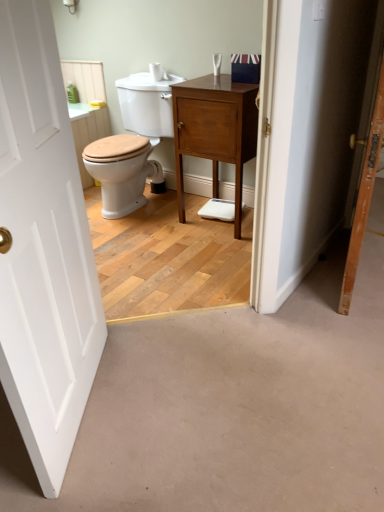
What do you see at coordinates (43, 248) in the screenshot? The width and height of the screenshot is (384, 512). I see `white wooden door at left, which is counted as the second door, starting from the right` at bounding box center [43, 248].

This screenshot has width=384, height=512. In order to click on matte wood nightstand at center in this screenshot , I will do `click(215, 130)`.

Is white wooden door at left, which is counted as the second door, starting from the right, closer to the viewer compared to wooden door at right, the second door in the left-to-right sequence?

Yes, the depth of white wooden door at left, which is counted as the second door, starting from the right, is less than that of wooden door at right, the second door in the left-to-right sequence.

Considering the positions of points (40, 211) and (379, 92), is point (40, 211) farther from camera compared to point (379, 92)?

No.

Is wooden door at right, the second door in the left-to-right sequence, completely or partially inside white wooden door at left, marked as the 1th door in a left-to-right arrangement?

No, wooden door at right, the second door in the left-to-right sequence, is not surrounded by white wooden door at left, marked as the 1th door in a left-to-right arrangement.

How different are the orientations of white wooden door at left, which is counted as the second door, starting from the right, and wooden door at right, acting as the 1th door starting from the right, in degrees?

white wooden door at left, which is counted as the second door, starting from the right, and wooden door at right, acting as the 1th door starting from the right, are facing 17.4 degrees away from each other.

Consider the image. From the image's perspective, between wooden door at right, the second door in the left-to-right sequence, and matte wood nightstand at center, who is located below?

wooden door at right, the second door in the left-to-right sequence, from the image's perspective.

Is wooden door at right, the second door in the left-to-right sequence, spatially inside matte wood nightstand at center, or outside of it?

wooden door at right, the second door in the left-to-right sequence, is not inside matte wood nightstand at center, it's outside.

In the scene shown: Is wooden door at right, acting as the 1th door starting from the right, facing towards matte wood nightstand at center?

No.

From a real-world perspective, which is physically below, white wooden door at left, which is counted as the second door, starting from the right, or matte wood nightstand at center?

matte wood nightstand at center.

How far apart are white wooden door at left, which is counted as the second door, starting from the right, and matte wood nightstand at center?

The distance of white wooden door at left, which is counted as the second door, starting from the right, from matte wood nightstand at center is 1.20 meters.

In the image, is white wooden door at left, which is counted as the second door, starting from the right, positioned in front of or behind matte wood nightstand at center?

Visually, white wooden door at left, which is counted as the second door, starting from the right, is located in front of matte wood nightstand at center.

Would you consider white wooden door at left, which is counted as the second door, starting from the right, to be distant from matte wood nightstand at center?

white wooden door at left, which is counted as the second door, starting from the right, is positioned a significant distance from matte wood nightstand at center.

Considering their positions, is matte wood nightstand at center located in front of or behind wooden door at right, the second door in the left-to-right sequence?

Clearly, matte wood nightstand at center is behind wooden door at right, the second door in the left-to-right sequence.

Between matte wood nightstand at center and wooden door at right, the second door in the left-to-right sequence, which one has more height?

wooden door at right, the second door in the left-to-right sequence.

Between matte wood nightstand at center and wooden door at right, the second door in the left-to-right sequence, which one has smaller width?

With smaller width is wooden door at right, the second door in the left-to-right sequence.

Measure the distance from matte wood nightstand at center to wooden door at right, the second door in the left-to-right sequence.

The distance of matte wood nightstand at center from wooden door at right, the second door in the left-to-right sequence, is 30.39 inches.

Is wooden door at right, the second door in the left-to-right sequence, to the left or to the right of white wooden door at left, which is counted as the second door, starting from the right, in the image?

In the image, wooden door at right, the second door in the left-to-right sequence, appears on the right side of white wooden door at left, which is counted as the second door, starting from the right.

From the image's perspective, which object appears higher, wooden door at right, the second door in the left-to-right sequence, or white wooden door at left, marked as the 1th door in a left-to-right arrangement?

wooden door at right, the second door in the left-to-right sequence, appears higher in the image.

From a real-world perspective, between wooden door at right, the second door in the left-to-right sequence, and white wooden door at left, marked as the 1th door in a left-to-right arrangement, who is vertically higher?

white wooden door at left, marked as the 1th door in a left-to-right arrangement, is physically above.

Is point (353, 274) positioned in front of point (84, 345)?

No.

Is white wooden door at left, marked as the 1th door in a left-to-right arrangement, at the back of matte wood nightstand at center?

That's not correct — matte wood nightstand at center is not looking away from white wooden door at left, marked as the 1th door in a left-to-right arrangement.

At what (x,y) coordinates should I click in order to perform the action: click on nightstand behind the white wooden door at left, which is counted as the second door, starting from the right. Please return your answer as a coordinate pair (x, y). Looking at the image, I should click on (215, 130).

Which object is more forward, matte wood nightstand at center or white wooden door at left, marked as the 1th door in a left-to-right arrangement?

white wooden door at left, marked as the 1th door in a left-to-right arrangement, is closer to the camera.

Is matte wood nightstand at center next to white wooden door at left, marked as the 1th door in a left-to-right arrangement?

No, matte wood nightstand at center is not with white wooden door at left, marked as the 1th door in a left-to-right arrangement.

Find the location of a particular element. This screenshot has height=512, width=384. door below the white wooden door at left, which is counted as the second door, starting from the right (from a real-world perspective) is located at coordinates (364, 195).

You are a GUI agent. You are given a task and a screenshot of the screen. Output one action in this format:
    pyautogui.click(x=<x>, y=<y>)
    Task: Click on the 1st door in front of the matte wood nightstand at center
    This screenshot has height=512, width=384.
    Given the screenshot: What is the action you would take?
    pyautogui.click(x=364, y=195)

Looking at the image, which one is located further to matte wood nightstand at center, wooden door at right, the second door in the left-to-right sequence, or white wooden door at left, marked as the 1th door in a left-to-right arrangement?

white wooden door at left, marked as the 1th door in a left-to-right arrangement, is positioned further to the anchor matte wood nightstand at center.

From the image, which object appears to be farther from white wooden door at left, which is counted as the second door, starting from the right, matte wood nightstand at center or wooden door at right, acting as the 1th door starting from the right?

matte wood nightstand at center is further to white wooden door at left, which is counted as the second door, starting from the right.

Looking at the image, which one is located further to matte wood nightstand at center, white wooden door at left, which is counted as the second door, starting from the right, or wooden door at right, the second door in the left-to-right sequence?

Based on the image, white wooden door at left, which is counted as the second door, starting from the right, appears to be further to matte wood nightstand at center.

From the image, which object appears to be nearer to wooden door at right, the second door in the left-to-right sequence, white wooden door at left, marked as the 1th door in a left-to-right arrangement, or matte wood nightstand at center?

matte wood nightstand at center is positioned closer to the anchor wooden door at right, the second door in the left-to-right sequence.

Considering their positions, is matte wood nightstand at center positioned closer to wooden door at right, acting as the 1th door starting from the right, than white wooden door at left, marked as the 1th door in a left-to-right arrangement?

Among the two, matte wood nightstand at center is located nearer to wooden door at right, acting as the 1th door starting from the right.

Based on their spatial positions, is wooden door at right, acting as the 1th door starting from the right, or matte wood nightstand at center further from white wooden door at left, marked as the 1th door in a left-to-right arrangement?

matte wood nightstand at center is positioned further to the anchor white wooden door at left, marked as the 1th door in a left-to-right arrangement.

Locate an element on the screen. This screenshot has width=384, height=512. door located between white wooden door at left, which is counted as the second door, starting from the right, and matte wood nightstand at center in the depth direction is located at coordinates (364, 195).